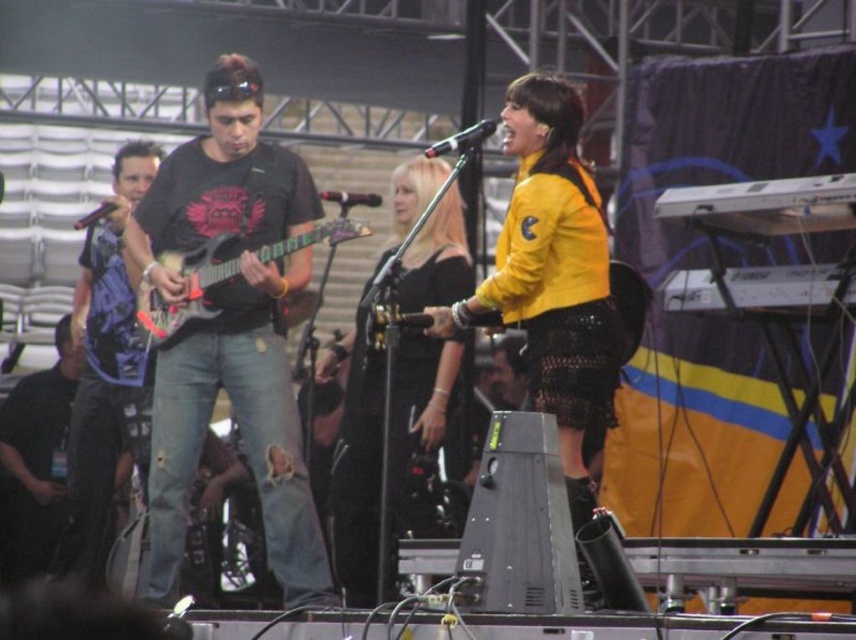
You are a photographer positioned at the back of the stage. You want to take a photo of the black leather dress at center without the yellow matte jacket at center blocking it. Is this possible given their positions?

The yellow matte jacket at center is in front of the black leather dress at center, so it would block the view. To capture the black leather dress at center without obstruction, you would need to adjust your angle or move closer to avoid the jacket.